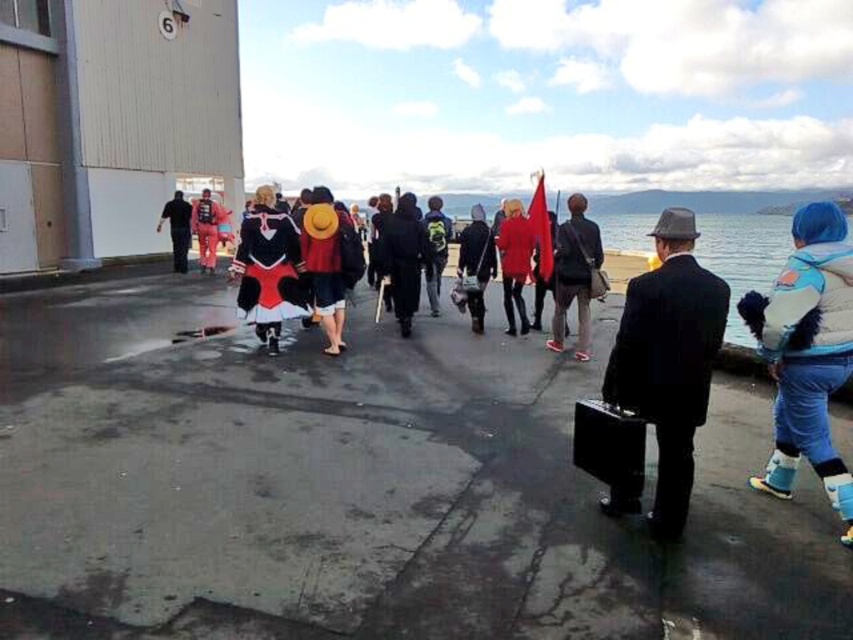
Question: Is blue fuzzy boots at lower right to the left of matte black jacket at center from the viewer's perspective?

Choices:
 (A) yes
 (B) no

Answer: (B)

Question: Which of the following is the closest to the observer?

Choices:
 (A) black matte coat at center
 (B) matte red and black outfit at center
 (C) matte red coat at center
 (D) matte black jacket at center

Answer: (B)

Question: Does matte black dress at center have a greater width compared to matte red coat at center?

Choices:
 (A) no
 (B) yes

Answer: (B)

Question: Which point is farther from the camera taking this photo?

Choices:
 (A) (189, 243)
 (B) (514, 310)

Answer: (A)

Question: Which point is closer to the camera taking this photo?

Choices:
 (A) click(x=321, y=256)
 (B) click(x=807, y=218)
 (C) click(x=407, y=234)

Answer: (B)

Question: Does blue fabric water at center lie behind matte red coat at center?

Choices:
 (A) no
 (B) yes

Answer: (A)